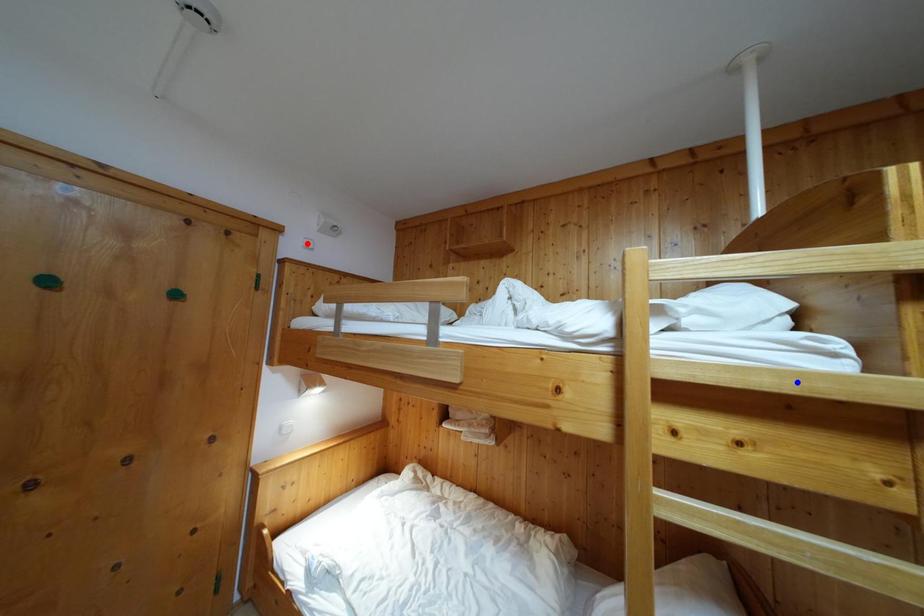
Question: Which of the two points in the image is closer to the camera?

Choices:
 (A) Blue point is closer.
 (B) Red point is closer.

Answer: (A)